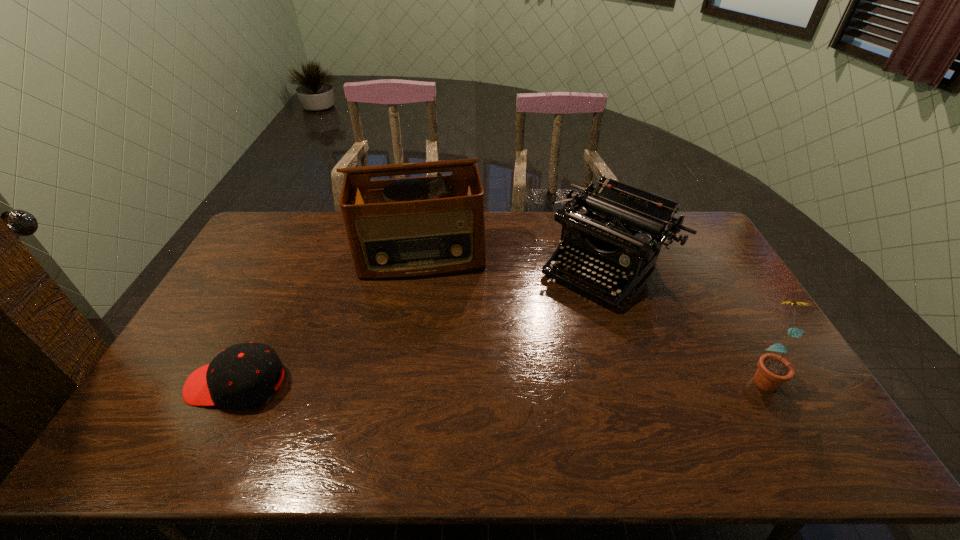
You are a GUI agent. You are given a task and a screenshot of the screen. Output one action in this format:
    pyautogui.click(x=<x>, y=<y>)
    Task: Click on the cap
    This screenshot has width=960, height=540.
    Given the screenshot: What is the action you would take?
    pyautogui.click(x=243, y=375)

I want to click on the shortest object, so click(x=243, y=375).

Identify the location of the rightmost object. (773, 370).

Where is `typewriter`? typewriter is located at coordinates (621, 228).

The image size is (960, 540). In order to click on the tallest object in this screenshot , I will do `click(422, 226)`.

The width and height of the screenshot is (960, 540). In order to click on radio receiver in this screenshot , I will do pos(422,226).

The height and width of the screenshot is (540, 960). Find the location of `vacant space located on the front-facing side of the cap`. vacant space located on the front-facing side of the cap is located at coordinates (161, 383).

The width and height of the screenshot is (960, 540). I want to click on vacant space located 0.380m on the keyboard of the second object from right to left, so click(x=496, y=379).

Where is `free space located on the keyboard of the second object from right to left`? This screenshot has height=540, width=960. free space located on the keyboard of the second object from right to left is located at coordinates (548, 325).

Where is `vacant area situated 0.230m on the keyboard of the second object from right to left`? The image size is (960, 540). vacant area situated 0.230m on the keyboard of the second object from right to left is located at coordinates (529, 345).